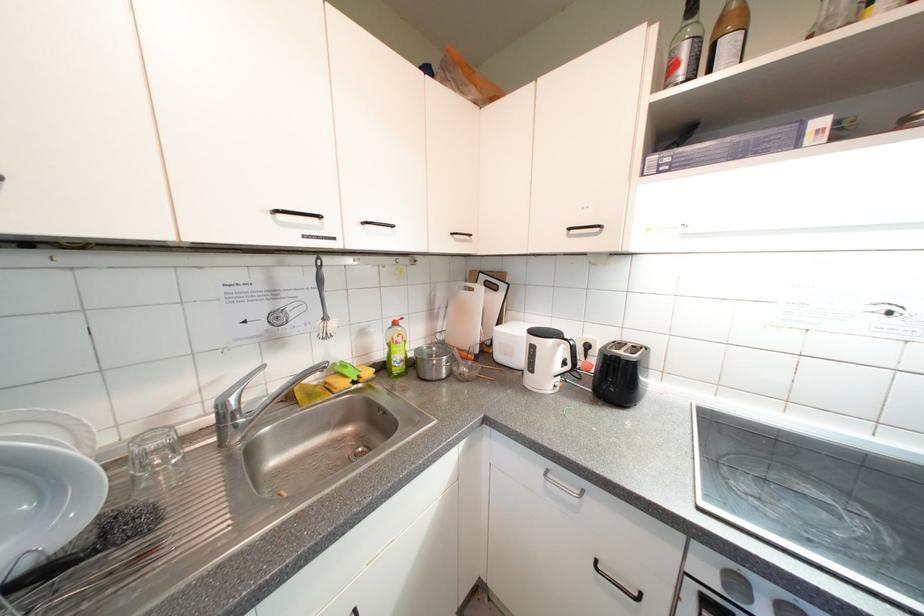
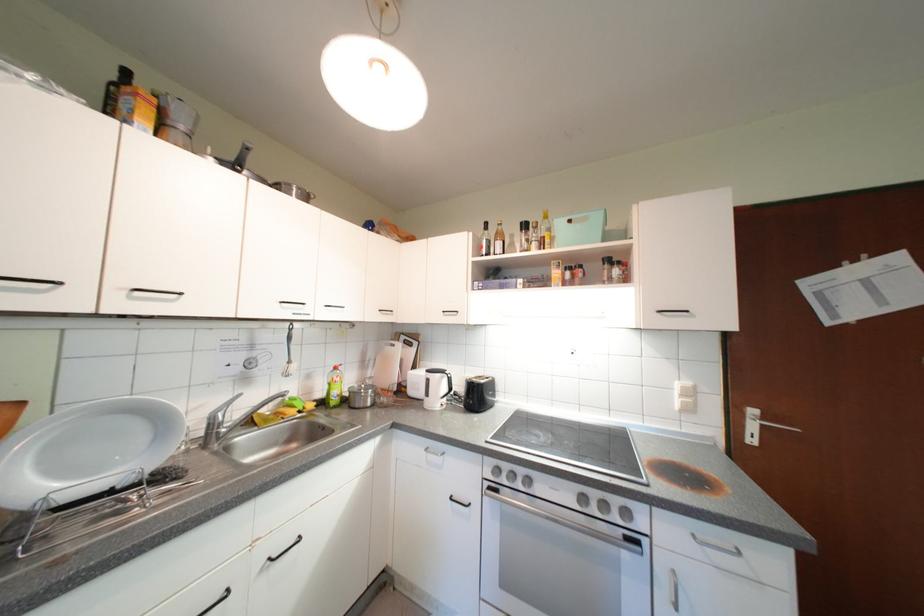
Where in the second image is the point corresponding to point (560, 342) from the first image?

(446, 378)